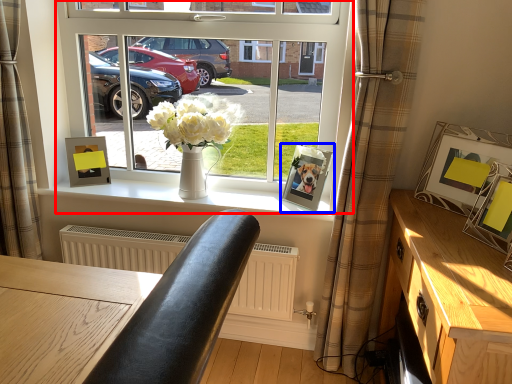
Question: Which object is further to the camera taking this photo, window (highlighted by a red box) or picture frame (highlighted by a blue box)?

Choices:
 (A) window
 (B) picture frame

Answer: (B)